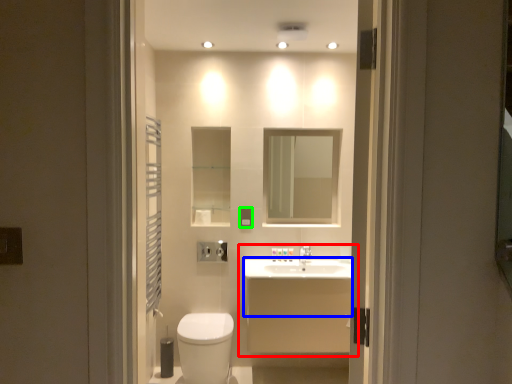
Question: Which object is positioned closest to bathroom cabinet (highlighted by a red box)? Select from counter top (highlighted by a blue box) and electric outlet (highlighted by a green box).

Choices:
 (A) counter top
 (B) electric outlet

Answer: (A)